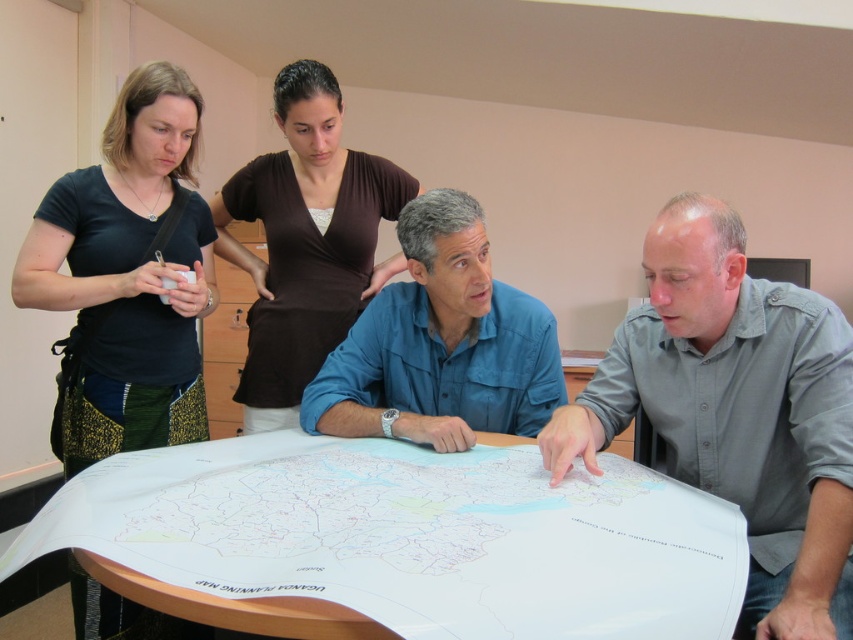
Question: Which object is the closest to the white paper map at center?

Choices:
 (A) black fabric apron at left
 (B) brown matte shirt at upper center
 (C) gray button-down shirt at lower right
 (D) blue cotton shirt at center

Answer: (C)

Question: Is black fabric apron at left bigger than brown matte shirt at upper center?

Choices:
 (A) yes
 (B) no

Answer: (B)

Question: Among these points, which one is farthest from the camera?

Choices:
 (A) (189, 122)
 (B) (605, 358)
 (C) (285, 388)
 (D) (463, 296)

Answer: (C)

Question: Which point is farther to the camera?

Choices:
 (A) (96, 636)
 (B) (279, 250)
 (C) (431, 300)
 (D) (627, 369)

Answer: (B)

Question: Is gray button-down shirt at lower right smaller than black fabric apron at left?

Choices:
 (A) no
 (B) yes

Answer: (A)

Question: Does gray button-down shirt at lower right have a larger size compared to brown matte shirt at upper center?

Choices:
 (A) yes
 (B) no

Answer: (B)